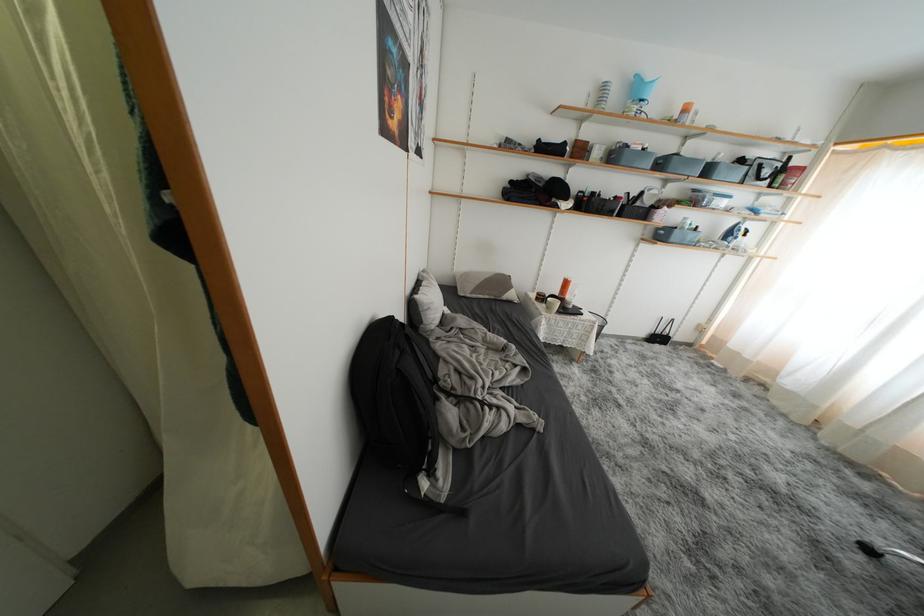
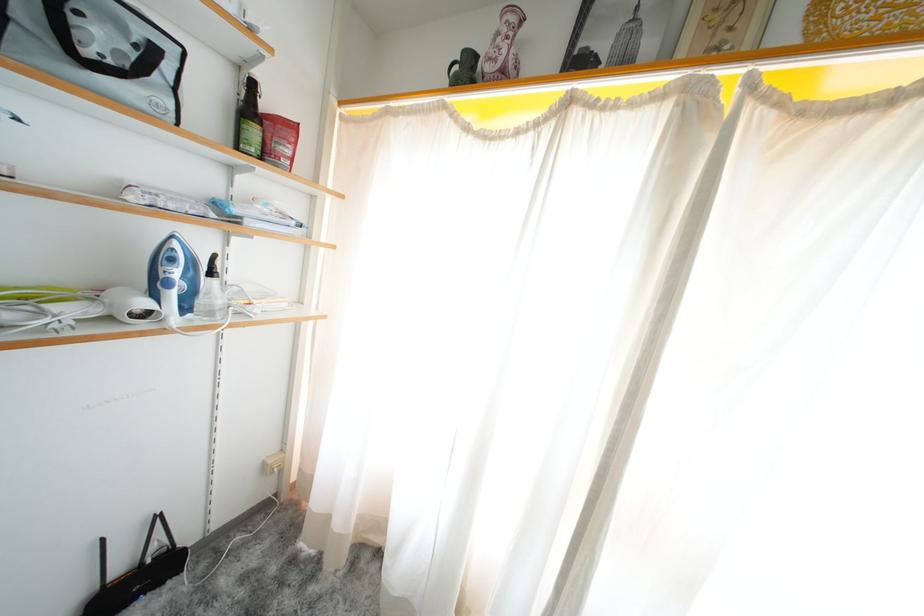
Locate, in the second image, the point that corresponds to the point at 664,342 in the first image.

(143, 586)